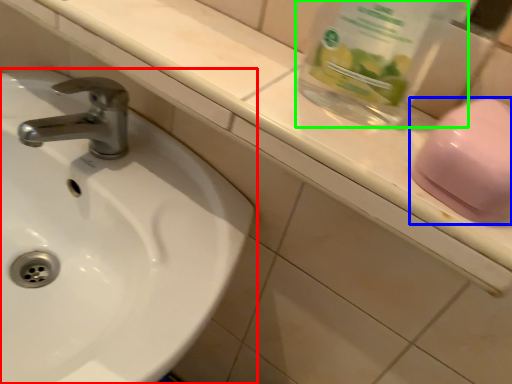
Question: Considering the real-world distances, which object is farthest from sink (highlighted by a red box)? soap (highlighted by a blue box) or glass jar (highlighted by a green box)?

Choices:
 (A) soap
 (B) glass jar

Answer: (A)